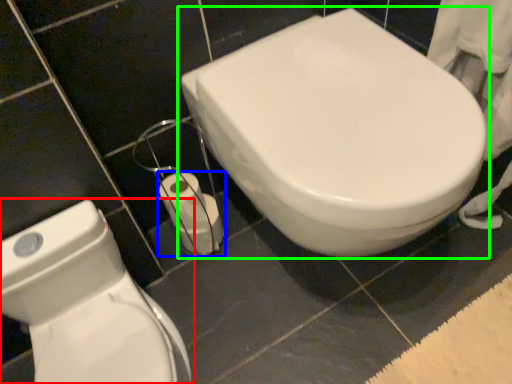
Question: Considering the real-world distances, which object is farthest from toilet (highlighted by a red box)? toilet paper (highlighted by a blue box) or toilet (highlighted by a green box)?

Choices:
 (A) toilet paper
 (B) toilet

Answer: (B)